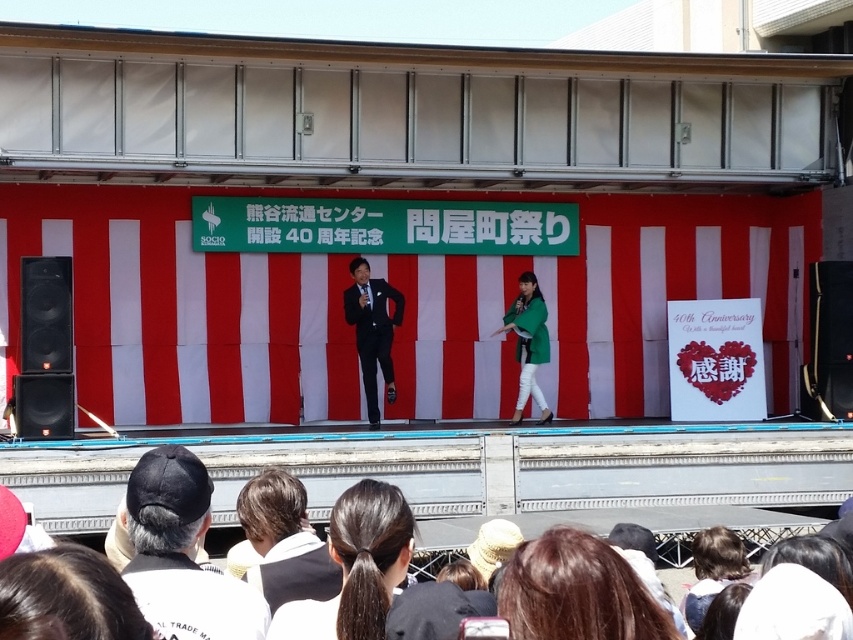
You are a photographer at the Kumagaya festival, and you need to capture a photo of the brown hair at lower center and the green matte jacket at center. Which object is located lower in the frame?

The brown hair at lower center is positioned under the green matte jacket at center, so it is located lower in the frame.